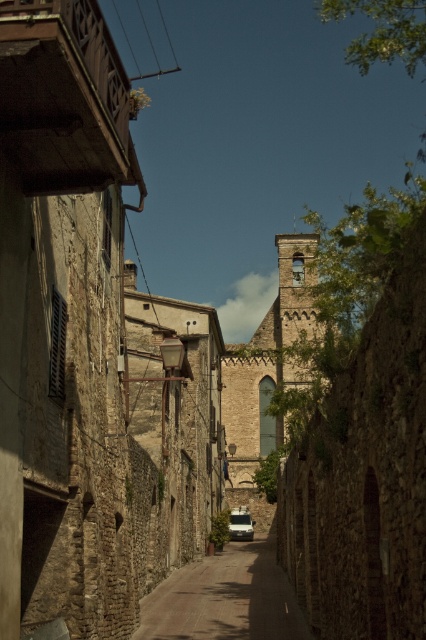
Question: Is smooth stone alley at center above white matte van at center?

Choices:
 (A) yes
 (B) no

Answer: (A)

Question: Does smooth stone alley at center appear over white matte van at center?

Choices:
 (A) no
 (B) yes

Answer: (B)

Question: Does smooth stone alley at center appear under white matte van at center?

Choices:
 (A) yes
 (B) no

Answer: (B)